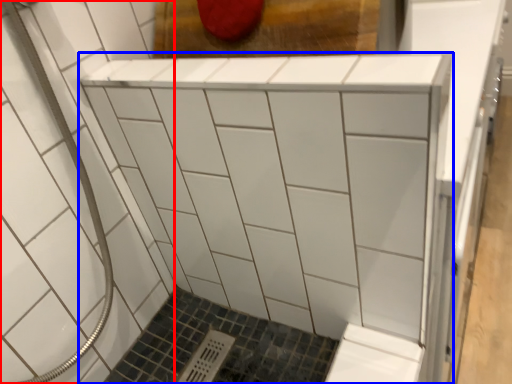
Question: Which object appears farthest to the camera in this image, bath (highlighted by a red box) or furniture (highlighted by a blue box)?

Choices:
 (A) bath
 (B) furniture

Answer: (B)